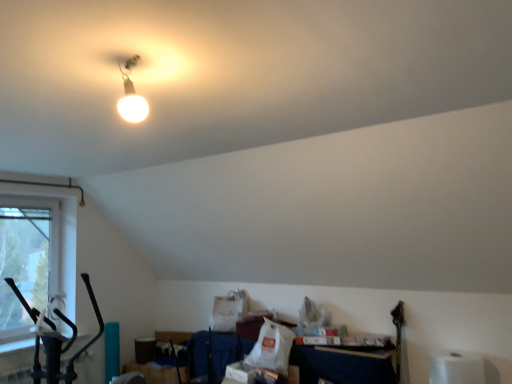
Question: Can you confirm if clear glass window at left is positioned to the right of matte white bulb at upper center?

Choices:
 (A) yes
 (B) no

Answer: (B)

Question: Are clear glass window at left and matte white bulb at upper center beside each other?

Choices:
 (A) yes
 (B) no

Answer: (B)

Question: Considering the relative sizes of clear glass window at left and matte white bulb at upper center in the image provided, is clear glass window at left smaller than matte white bulb at upper center?

Choices:
 (A) no
 (B) yes

Answer: (A)

Question: Considering the relative sizes of clear glass window at left and matte white bulb at upper center in the image provided, is clear glass window at left thinner than matte white bulb at upper center?

Choices:
 (A) no
 (B) yes

Answer: (B)

Question: Is clear glass window at left bigger than matte white bulb at upper center?

Choices:
 (A) yes
 (B) no

Answer: (A)

Question: Is clear glass window at left oriented towards matte white bulb at upper center?

Choices:
 (A) yes
 (B) no

Answer: (B)

Question: Does matte white bulb at upper center have a larger size compared to white matte toilet paper at lower right?

Choices:
 (A) no
 (B) yes

Answer: (A)

Question: Considering the relative sizes of matte white bulb at upper center and white matte toilet paper at lower right in the image provided, is matte white bulb at upper center shorter than white matte toilet paper at lower right?

Choices:
 (A) yes
 (B) no

Answer: (A)

Question: Is matte white bulb at upper center outside of white matte toilet paper at lower right?

Choices:
 (A) yes
 (B) no

Answer: (A)

Question: Considering the relative sizes of matte white bulb at upper center and white matte toilet paper at lower right in the image provided, is matte white bulb at upper center thinner than white matte toilet paper at lower right?

Choices:
 (A) no
 (B) yes

Answer: (B)

Question: Is matte white bulb at upper center at the left side of white matte toilet paper at lower right?

Choices:
 (A) no
 (B) yes

Answer: (B)

Question: From the image's perspective, is matte white bulb at upper center beneath white matte toilet paper at lower right?

Choices:
 (A) yes
 (B) no

Answer: (B)

Question: Could you tell me if white matte toilet paper at lower right is facing clear glass window at left?

Choices:
 (A) yes
 (B) no

Answer: (B)